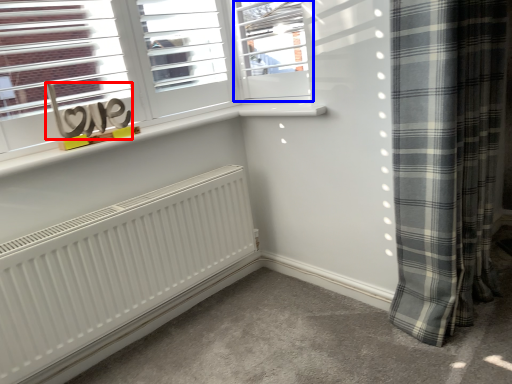
Question: Which of the following is the closest to the observer, writing (highlighted by a red box) or window (highlighted by a blue box)?

Choices:
 (A) writing
 (B) window

Answer: (A)